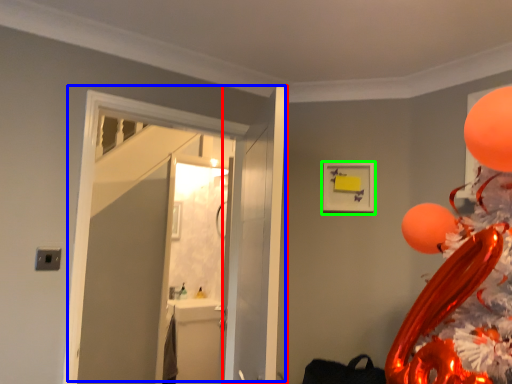
Question: Which is farther away from door (highlighted by a red box)? door (highlighted by a blue box) or picture frame (highlighted by a green box)?

Choices:
 (A) door
 (B) picture frame

Answer: (B)